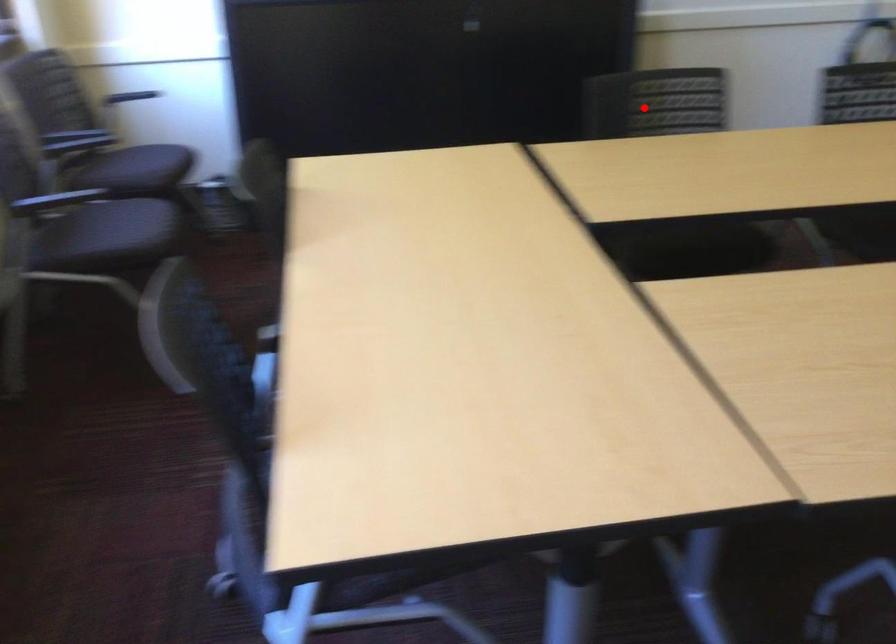
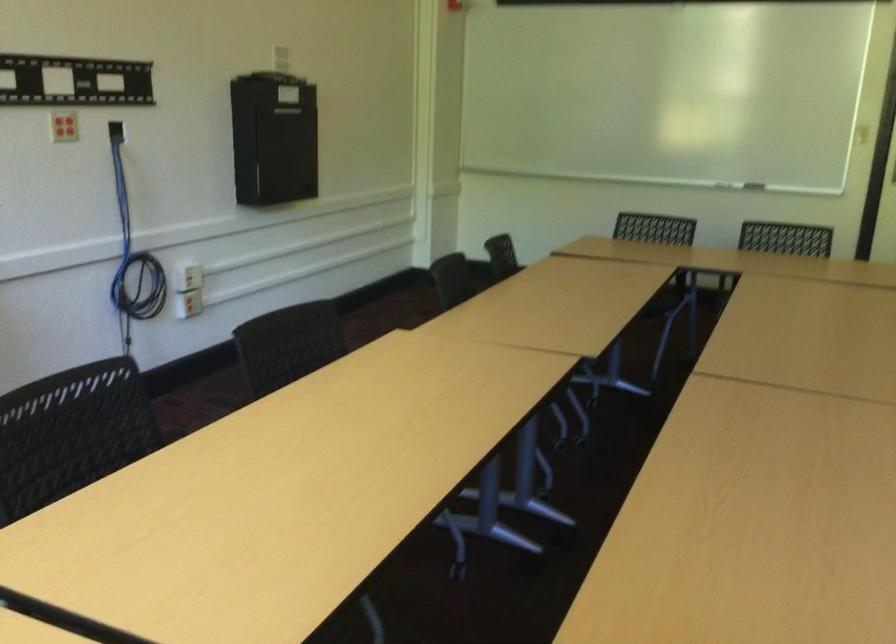
Question: I am providing you with two images of the same scene from different viewpoints. A red point is shown in image1. For the corresponding object point in image2, is it positioned nearer or farther from the camera?

Choices:
 (A) Nearer
 (B) Farther

Answer: (A)